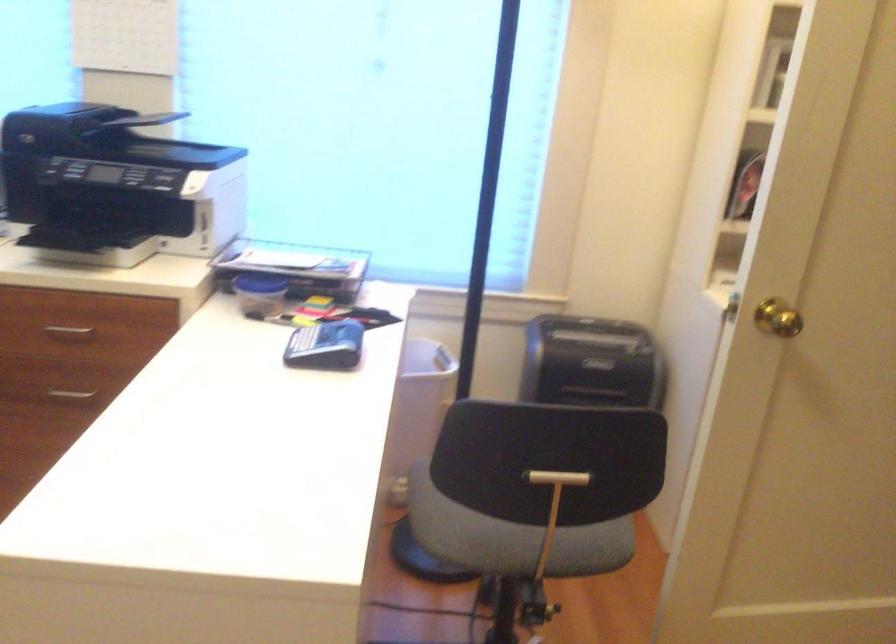
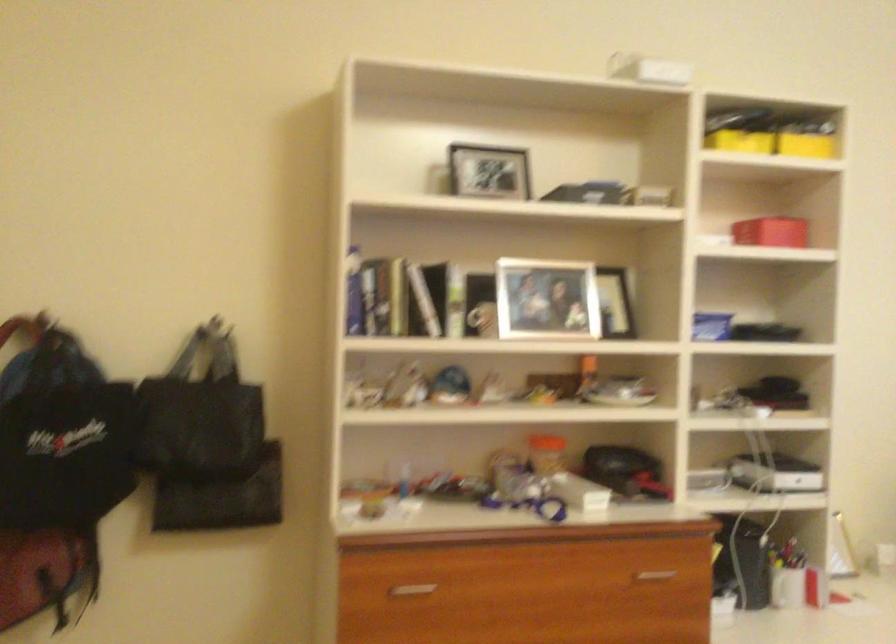
Question: How did the camera likely rotate?

Choices:
 (A) Left
 (B) Right
 (C) Up
 (D) Down

Answer: (A)